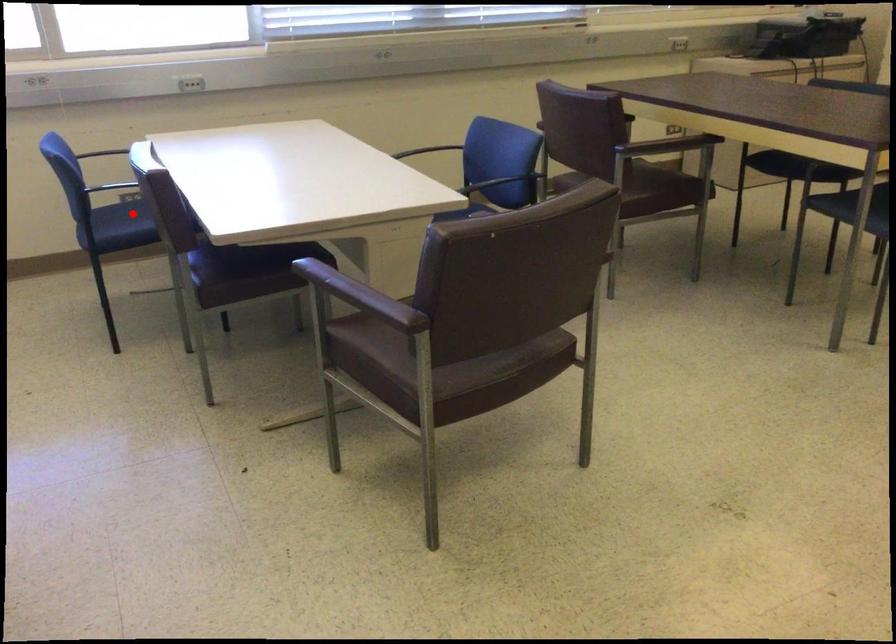
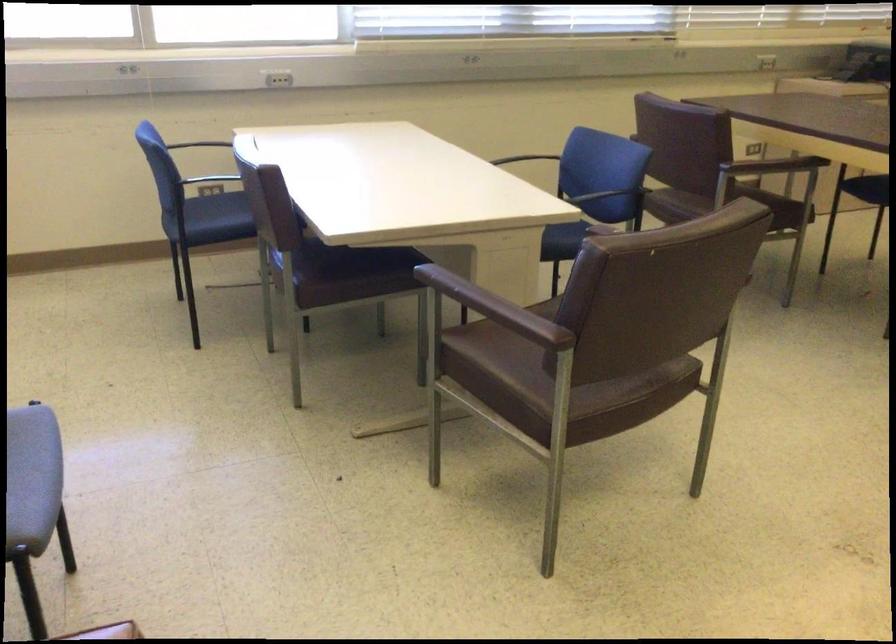
In the second image, find the point that corresponds to the highlighted location in the first image.

(220, 207)